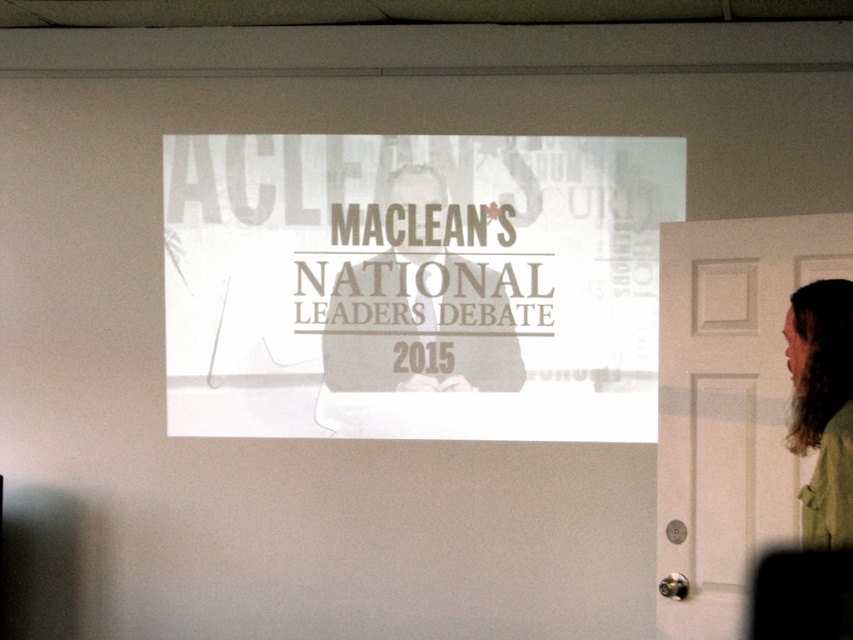
Question: Is white paper at center thinner than green matte jacket at right?

Choices:
 (A) no
 (B) yes

Answer: (A)

Question: Does white paper at center appear on the right side of green matte jacket at right?

Choices:
 (A) no
 (B) yes

Answer: (A)

Question: Considering the real-world distances, which object is farthest from the matte paper sign at center?

Choices:
 (A) green matte jacket at right
 (B) white paper at center

Answer: (A)

Question: Which point is closer to the camera?

Choices:
 (A) matte paper sign at center
 (B) white paper at center
 (C) green matte jacket at right

Answer: (C)

Question: Estimate the real-world distances between objects in this image. Which object is closer to the white paper at center?

Choices:
 (A) matte paper sign at center
 (B) green matte jacket at right

Answer: (A)

Question: Is matte paper sign at center thinner than green matte jacket at right?

Choices:
 (A) yes
 (B) no

Answer: (B)